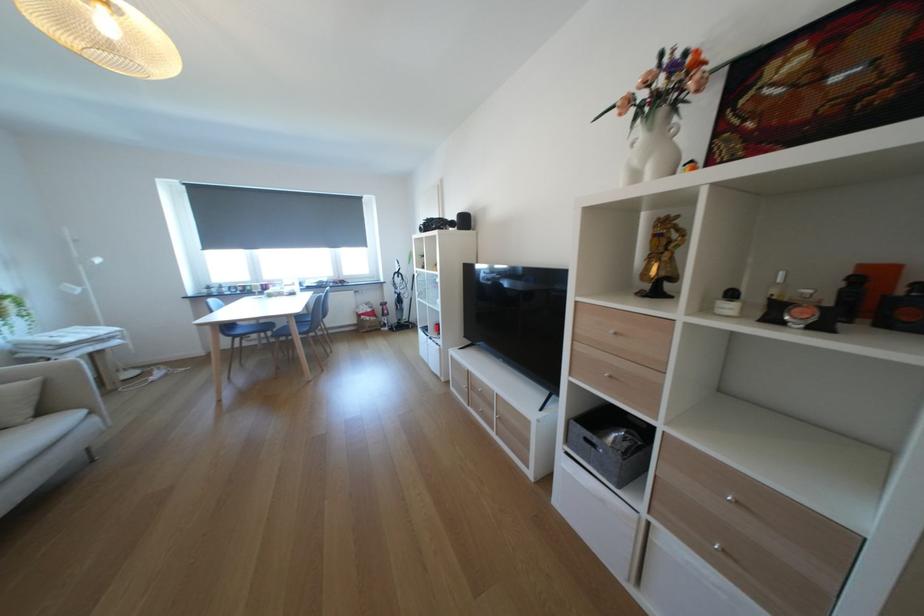
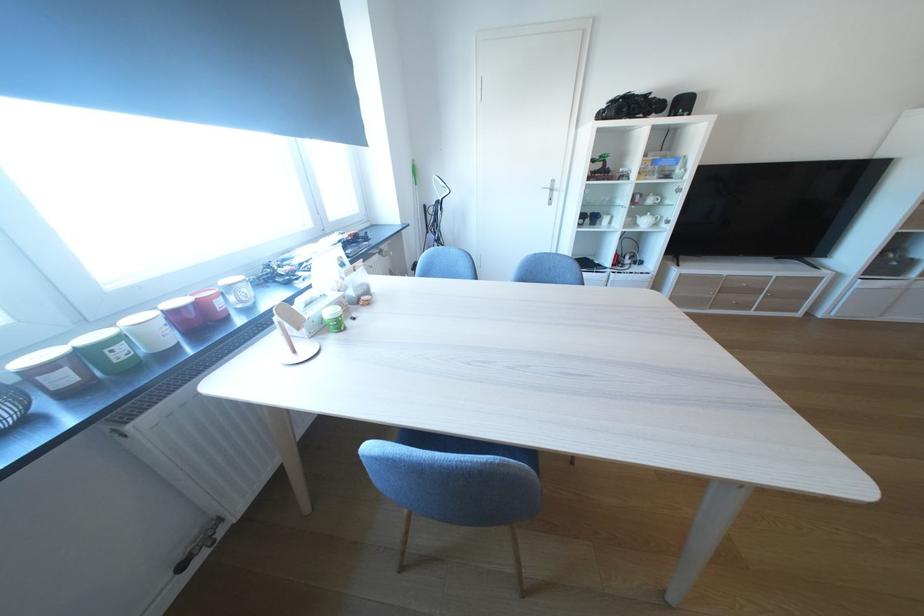
Locate, in the second image, the point that corresponds to pixel 275 288 in the first image.

(207, 317)